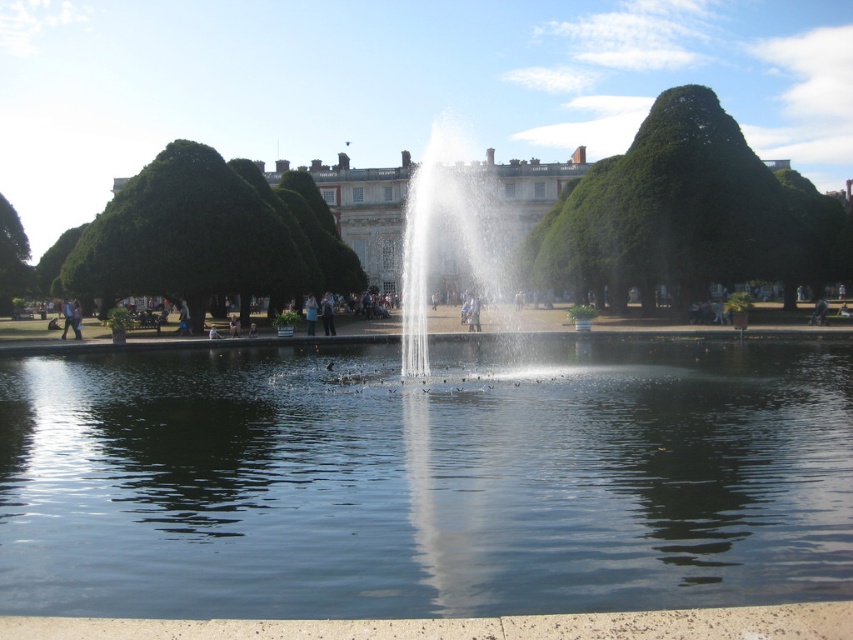
Does point (616, 252) lie behind point (65, 314)?

That is False.

Who is higher up, green leafy tree at upper center or light blue jeans at left?

green leafy tree at upper center is higher up.

Describe the element at coordinates (688, 214) in the screenshot. The width and height of the screenshot is (853, 640). I see `green leafy tree at upper center` at that location.

At what (x,y) coordinates should I click in order to perform the action: click on green leafy tree at upper center. Please return your answer as a coordinate pair (x, y). Looking at the image, I should click on (688, 214).

Does green leafy tree at upper left appear on the left side of dark blue jeans at center?

Correct, you'll find green leafy tree at upper left to the left of dark blue jeans at center.

The height and width of the screenshot is (640, 853). Identify the location of green leafy tree at upper left. (184, 236).

I want to click on green leafy tree at upper left, so click(x=184, y=236).

Between transparent glass lake at center and clear water fountain at center, which one has less height?

transparent glass lake at center is shorter.

You are a GUI agent. You are given a task and a screenshot of the screen. Output one action in this format:
    pyautogui.click(x=<x>, y=<y>)
    Task: Click on the transparent glass lake at center
    This screenshot has height=640, width=853.
    Given the screenshot: What is the action you would take?
    pyautogui.click(x=425, y=480)